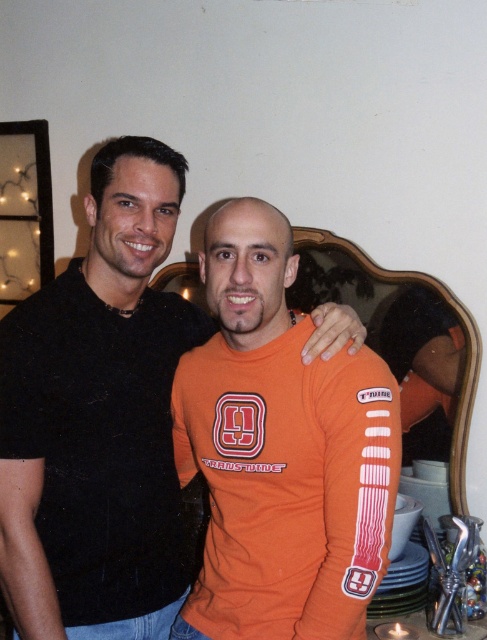
You are a photographer trying to capture a group photo of two people wearing the orange jersey at center. The photographer wants to ensure that both subjects are within the frame and close enough for clear facial features. Given that the camera has a maximum focus range of 4 feet, can the photographer capture both individuals in focus without moving the camera?

The two individuals are 3.52 feet apart, which is within the camera maximum focus range of 4 feet. Therefore, the photographer can capture both individuals in focus without moving the camera.